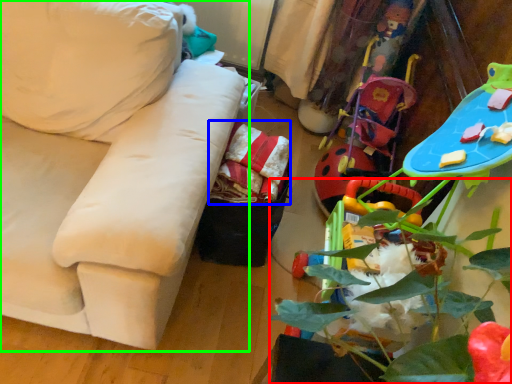
Question: Which is nearer to the plant (highlighted by a red box)? material (highlighted by a blue box) or studio couch (highlighted by a green box).

Choices:
 (A) material
 (B) studio couch

Answer: (A)